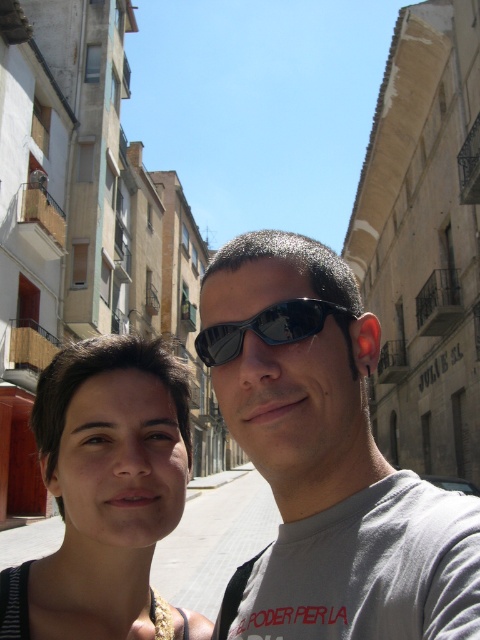
Question: Which object is positioned farthest from the black reflective sunglasses at center?

Choices:
 (A) matte black hair at center
 (B) matte gray t-shirt at center

Answer: (A)

Question: Which point is farther to the camera?

Choices:
 (A) (345, 308)
 (B) (299, 515)

Answer: (B)

Question: Which point appears closest to the camera in this image?

Choices:
 (A) (238, 332)
 (B) (71, 586)
 (C) (340, 625)

Answer: (C)

Question: Is matte gray t-shirt at center smaller than matte black hair at center?

Choices:
 (A) no
 (B) yes

Answer: (A)

Question: Does matte black hair at center lie in front of black reflective sunglasses at center?

Choices:
 (A) no
 (B) yes

Answer: (B)

Question: Is matte gray t-shirt at center in front of matte black hair at center?

Choices:
 (A) no
 (B) yes

Answer: (B)